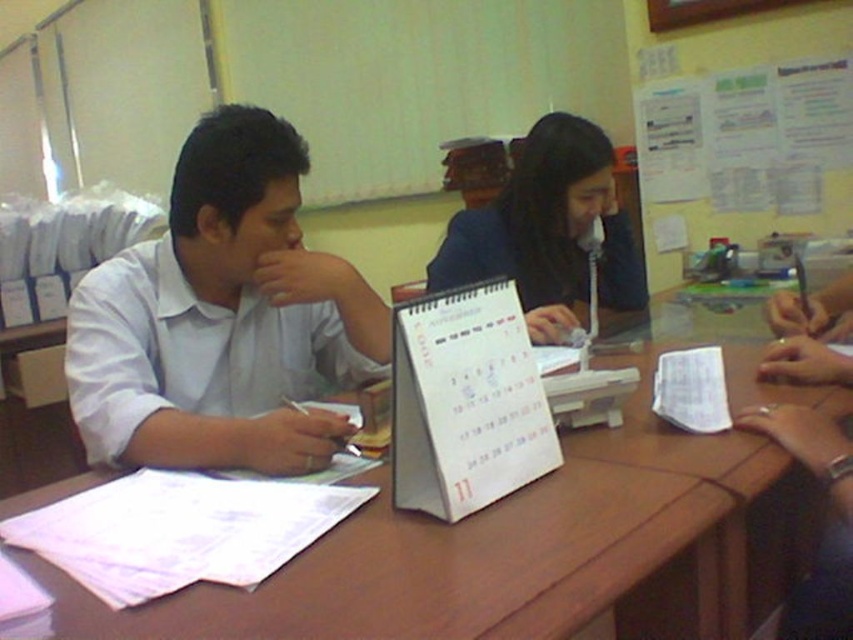
Who is more distant from viewer, (544, 561) or (178, 173)?

Point (178, 173)

Does point (728, 460) come in front of point (184, 321)?

Yes, it is.

Is point (576, 470) closer to viewer compared to point (186, 138)?

Yes, point (576, 470) is closer to viewer.

At what (x,y) coordinates should I click in order to perform the action: click on wooden table at center. Please return your answer as a coordinate pair (x, y). The image size is (853, 640). Looking at the image, I should click on (520, 552).

Can you confirm if white shirt at left is shorter than smooth brown wristwatch at lower right?

No.

Locate an element on the screen. white shirt at left is located at coordinates (221, 317).

Does point (515, 193) come behind point (669, 417)?

Yes, point (515, 193) is farther from viewer.

Can you confirm if black matte hair at center is taller than white paper notepad at center?

Indeed, black matte hair at center has a greater height compared to white paper notepad at center.

The width and height of the screenshot is (853, 640). Describe the element at coordinates (547, 228) in the screenshot. I see `black matte hair at center` at that location.

Locate an element on the screen. This screenshot has width=853, height=640. black matte hair at center is located at coordinates (547, 228).